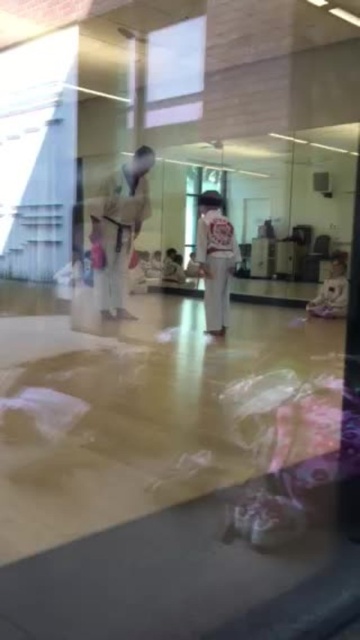
You are a student in the dojo and need to hand a belt to the instructor. The belt is currently on the floor between the white karate uniform at center and the white cotton karate uniform at center. Can you reach it without moving either uniform?

The belt is between the white karate uniform at center and the white cotton karate uniform at center, which are 88.59 centimeters apart. Since the distance is quite large, you should be able to reach the belt without disturbing the uniforms.

You are standing at the origin point of the coordinate system in the dojo. The instructor is wearing the white cotton karate uniform at center. Where exactly is the instructor located in terms of coordinates?

The white cotton karate uniform at center is located at coordinates point (214, 259).

You are a student in the dojo and want to hand a note to the instructor wearing the white cotton karate uniform at center. There is also a student wearing the white cotton shirt at right nearby. Which person should you approach first to reach the instructor?

You should approach the white cotton karate uniform at center first because it is closer to you than the white cotton shirt at right, so you don